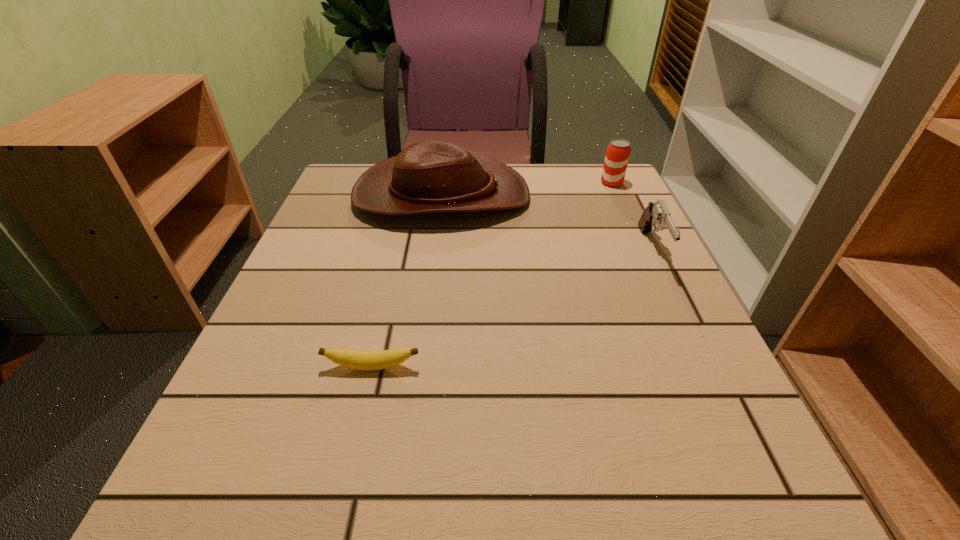
Find the location of a particular element. The height and width of the screenshot is (540, 960). free spot that satisfies the following two spatial constraints: 1. on the front side of the beer can; 2. on the front-facing side of the cowboy hat is located at coordinates (617, 195).